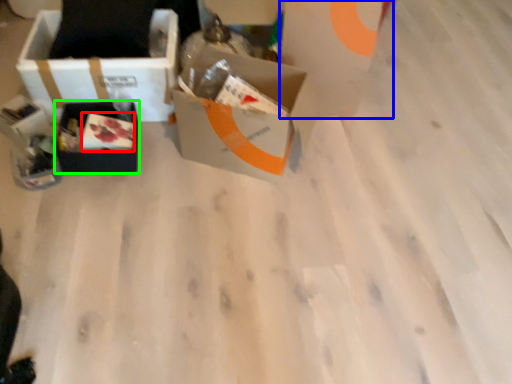
Question: Which object is the closest to the food (highlighted by a red box)? Choose among these: cardboard box (highlighted by a blue box) or box (highlighted by a green box).

Choices:
 (A) cardboard box
 (B) box

Answer: (B)